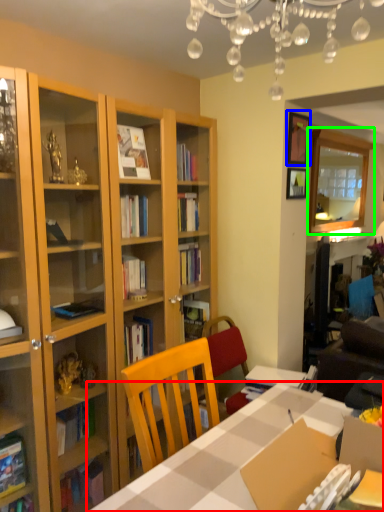
Question: Estimate the real-world distances between objects in this image. Which object is farther from table (highlighted by a red box), picture frame (highlighted by a blue box) or glass door (highlighted by a green box)?

Choices:
 (A) picture frame
 (B) glass door

Answer: (B)